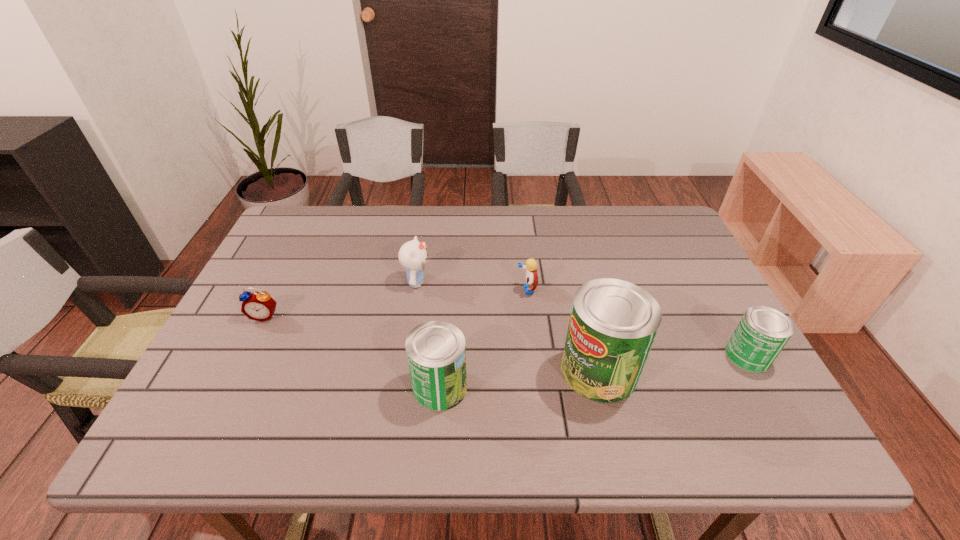
Find the location of a particular element. The height and width of the screenshot is (540, 960). empty space that is in between the second can from left to right and the kitten is located at coordinates (508, 326).

Locate an element on the screen. free space that is in between the leftmost can and the tallest can is located at coordinates (519, 379).

Identify the location of object that can be found as the fourth closest to the alarm clock. This screenshot has height=540, width=960. (613, 323).

Locate an element on the screen. Image resolution: width=960 pixels, height=540 pixels. object that is the second nearest to the kitten is located at coordinates (531, 283).

Image resolution: width=960 pixels, height=540 pixels. In order to click on can that is the second closest to the kitten in this screenshot , I will do `click(613, 323)`.

Where is `can that is the third nearest to the third object from right to left`? The width and height of the screenshot is (960, 540). can that is the third nearest to the third object from right to left is located at coordinates (761, 334).

At what (x,y) coordinates should I click in order to perform the action: click on vacant point that satisfies the following two spatial constraints: 1. on the front-facing side of the tallest can; 2. on the right side of the leftmost object. Please return your answer as a coordinate pair (x, y). The height and width of the screenshot is (540, 960). Looking at the image, I should click on (238, 371).

Identify the location of free space that satisfies the following two spatial constraints: 1. on the front-facing side of the kitten; 2. on the back side of the second can from left to right. The height and width of the screenshot is (540, 960). (402, 371).

At what (x,y) coordinates should I click in order to perform the action: click on free spot that satisfies the following two spatial constraints: 1. on the front-facing side of the kitten; 2. on the front-facing side of the alarm clock. Please return your answer as a coordinate pair (x, y). The width and height of the screenshot is (960, 540). Looking at the image, I should click on (411, 316).

The height and width of the screenshot is (540, 960). What are the coordinates of `free space that satisfies the following two spatial constraints: 1. on the back side of the rightmost object; 2. on the front-facing side of the kitten` in the screenshot? It's located at (707, 282).